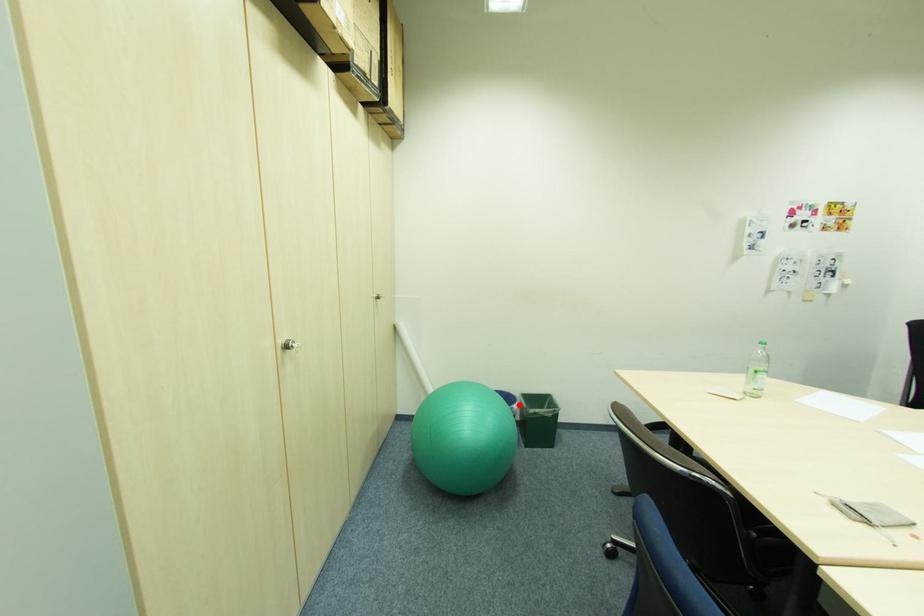
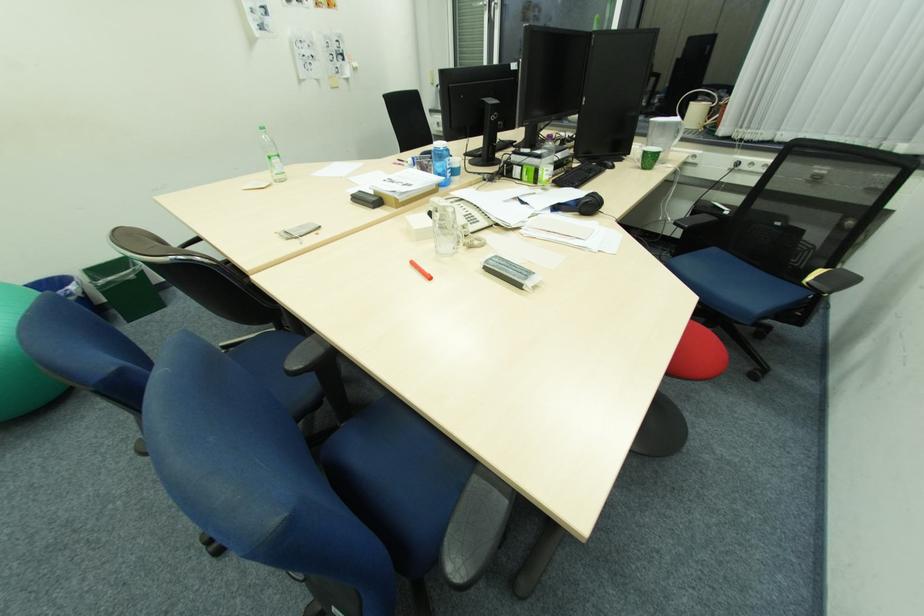
Question: I am providing you with two images of the same scene from different viewpoints. In image1, a red point is highlighted. Considering the same 3D point in image2, which of the following is correct?

Choices:
 (A) It is closer
 (B) It is farther

Answer: (B)